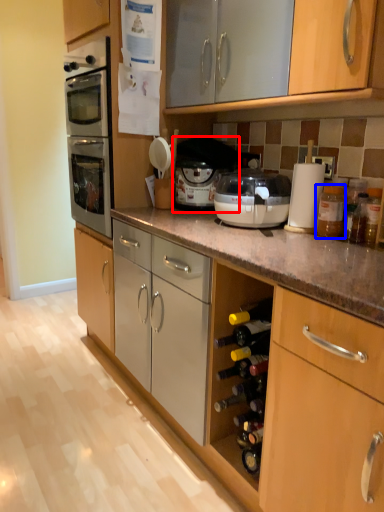
Question: Which point is further to the camera, appliance (highlighted by a red box) or bottle (highlighted by a blue box)?

Choices:
 (A) appliance
 (B) bottle

Answer: (A)